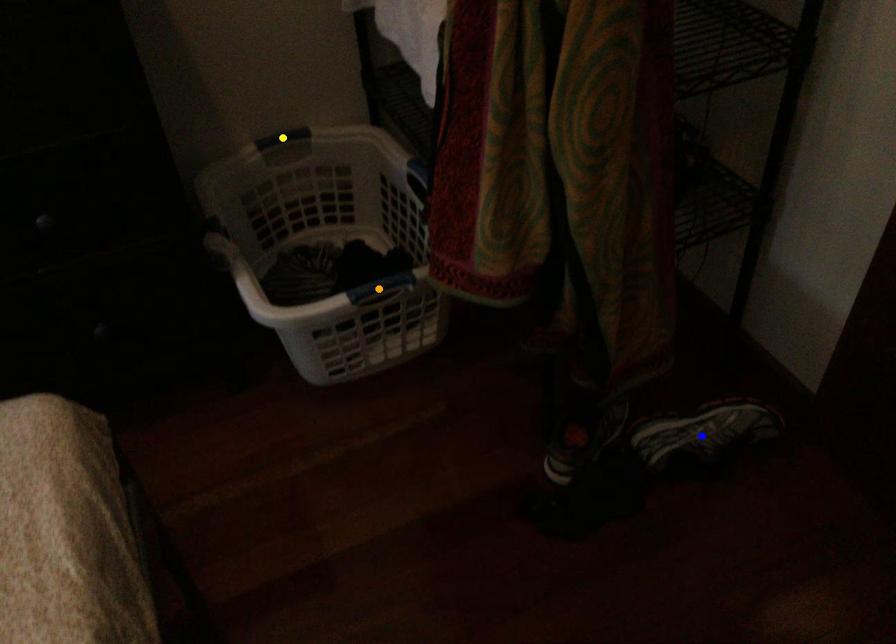
From the picture: Order these from nearest to farthest:
1. orange point
2. blue point
3. yellow point

yellow point → blue point → orange point